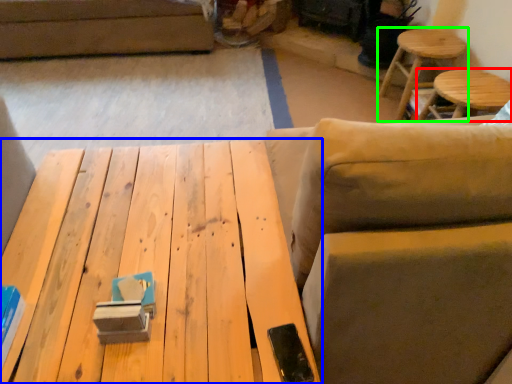
Question: Based on their relative distances, which object is farther from stool (highlighted by a red box)? Choose from table (highlighted by a blue box) and stool (highlighted by a green box).

Choices:
 (A) table
 (B) stool

Answer: (A)